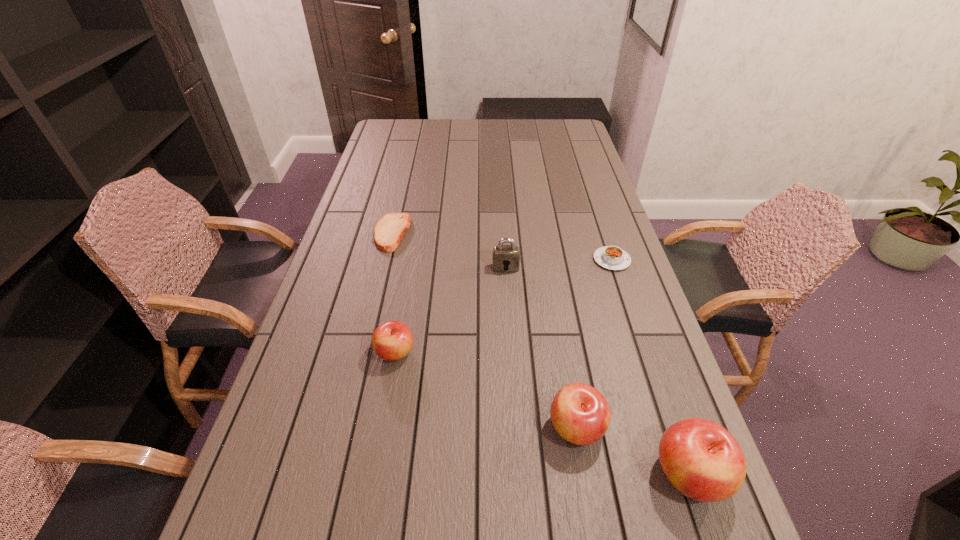
You are a GUI agent. You are given a task and a screenshot of the screen. Output one action in this format:
    pyautogui.click(x=<x>, y=<y>)
    Task: Click on the free space at the far edge of the desktop
    
    Given the screenshot: What is the action you would take?
    pyautogui.click(x=529, y=129)

In the image, there is a desktop. Where is `vacant space at the near edge`? Image resolution: width=960 pixels, height=540 pixels. vacant space at the near edge is located at coordinates (410, 470).

Locate an element on the screen. The width and height of the screenshot is (960, 540). free space at the left edge is located at coordinates (373, 220).

Where is `vacant region at the right edge of the desktop`? The width and height of the screenshot is (960, 540). vacant region at the right edge of the desktop is located at coordinates (611, 242).

The height and width of the screenshot is (540, 960). In the image, there is a desktop. Find the location of `vacant space at the near left corner`. vacant space at the near left corner is located at coordinates (313, 476).

Locate an element on the screen. The width and height of the screenshot is (960, 540). free space at the far right corner of the desktop is located at coordinates (557, 123).

Locate an element on the screen. The image size is (960, 540). free space at the near right corner is located at coordinates (668, 498).

Locate an element on the screen. vacant space that's between the second shortest object and the leftmost apple is located at coordinates (503, 306).

In order to click on free area in between the tallest object and the shortest object in this screenshot , I will do `click(540, 354)`.

Locate an element on the screen. blank region between the rightmost apple and the pudding is located at coordinates pos(651,367).